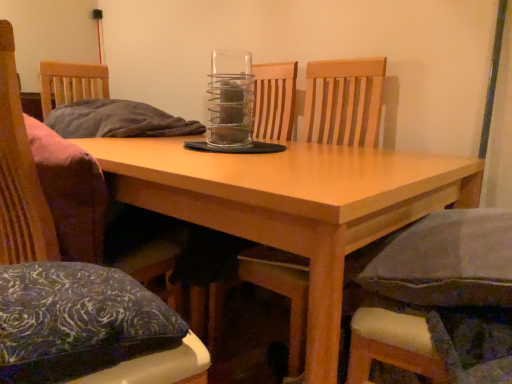
The image size is (512, 384). What do you see at coordinates (437, 301) in the screenshot?
I see `fabric cushioned chair at lower right, marked as the third chair in a left-to-right arrangement` at bounding box center [437, 301].

Find the location of a particular element. This screenshot has width=512, height=384. fabric cushioned chair at lower right, marked as the third chair in a left-to-right arrangement is located at coordinates (437, 301).

Describe the element at coordinates (293, 205) in the screenshot. The image size is (512, 384). I see `light wood table at center` at that location.

Where is `clear glass spiral at center`? clear glass spiral at center is located at coordinates (231, 98).

Can you tell me how much fabric cushioned chair at lower right, positioned as the 1th chair in right-to-left order, and wooden chair at center, which is the second chair in right-to-left order, differ in facing direction?

79.6 degrees separate the facing orientations of fabric cushioned chair at lower right, positioned as the 1th chair in right-to-left order, and wooden chair at center, which is the second chair in right-to-left order.

From the image's perspective, which one is positioned higher, fabric cushioned chair at lower right, marked as the third chair in a left-to-right arrangement, or wooden chair at center, which is the second chair from left to right?

wooden chair at center, which is the second chair from left to right, from the image's perspective.

Does point (410, 350) lie in front of point (337, 129)?

Yes, it is in front of point (337, 129).

From a real-world perspective, between fabric cushioned chair at lower right, marked as the third chair in a left-to-right arrangement, and wooden chair at center, which is the second chair in right-to-left order, who is vertically higher?

fabric cushioned chair at lower right, marked as the third chair in a left-to-right arrangement, from a real-world perspective.

Is fabric cushioned chair at lower right, marked as the third chair in a left-to-right arrangement, positioned behind matte black pillow at center?

No, fabric cushioned chair at lower right, marked as the third chair in a left-to-right arrangement, is in front of matte black pillow at center.

Which of these two, fabric cushioned chair at lower right, marked as the third chair in a left-to-right arrangement, or matte black pillow at center, stands taller?

With more height is matte black pillow at center.

Is fabric cushioned chair at lower right, positioned as the 1th chair in right-to-left order, positioned far away from matte black pillow at center?

fabric cushioned chair at lower right, positioned as the 1th chair in right-to-left order, is actually quite close to matte black pillow at center.

Is fabric cushioned chair at lower right, marked as the third chair in a left-to-right arrangement, looking in the opposite direction of matte black pillow at center?

No, matte black pillow at center is not at the back of fabric cushioned chair at lower right, marked as the third chair in a left-to-right arrangement.

Is clear glass spiral at center at the back of blue patterned pillow at lower left?

No, clear glass spiral at center is not at the back of blue patterned pillow at lower left.

Which is more to the left, blue patterned pillow at lower left or clear glass spiral at center?

From the viewer's perspective, blue patterned pillow at lower left appears more on the left side.

Is blue patterned pillow at lower left with clear glass spiral at center?

No, blue patterned pillow at lower left is not touching clear glass spiral at center.

In terms of height, does blue patterned pillow at lower left look taller or shorter compared to clear glass spiral at center?

Clearly, blue patterned pillow at lower left is shorter compared to clear glass spiral at center.

Which object is positioned more to the right, fabric cushioned chair at lower right, marked as the third chair in a left-to-right arrangement, or blue patterned pillow at lower left?

From the viewer's perspective, fabric cushioned chair at lower right, marked as the third chair in a left-to-right arrangement, appears more on the right side.

Is fabric cushioned chair at lower right, marked as the third chair in a left-to-right arrangement, wider or thinner than blue patterned pillow at lower left?

In the image, fabric cushioned chair at lower right, marked as the third chair in a left-to-right arrangement, appears to be more narrow than blue patterned pillow at lower left.

Between fabric cushioned chair at lower right, marked as the third chair in a left-to-right arrangement, and blue patterned pillow at lower left, which one has larger size?

With larger size is fabric cushioned chair at lower right, marked as the third chair in a left-to-right arrangement.

From the image's perspective, is light wood table at center over fabric cushioned chair at lower right, positioned as the 1th chair in right-to-left order?

No, from the image's perspective, light wood table at center is not above fabric cushioned chair at lower right, positioned as the 1th chair in right-to-left order.

Considering the relative positions of light wood table at center and fabric cushioned chair at lower right, marked as the third chair in a left-to-right arrangement, in the image provided, is light wood table at center to the left of fabric cushioned chair at lower right, marked as the third chair in a left-to-right arrangement, from the viewer's perspective?

Yes, light wood table at center is to the left of fabric cushioned chair at lower right, marked as the third chair in a left-to-right arrangement.

Considering the points (292, 234) and (418, 299), which point is in front, point (292, 234) or point (418, 299)?

Point (292, 234)

Where is `the 1st chair behind when counting from the light wood table at center`? This screenshot has height=384, width=512. the 1st chair behind when counting from the light wood table at center is located at coordinates (437, 301).

Considering the sizes of matte black pillow at center and blue patterned pillow at lower left in the image, is matte black pillow at center taller or shorter than blue patterned pillow at lower left?

matte black pillow at center is taller than blue patterned pillow at lower left.

From the picture: Between matte black pillow at center and blue patterned pillow at lower left, which one has larger size?

matte black pillow at center.

From the image's perspective, is matte black pillow at center under blue patterned pillow at lower left?

No, from the image's perspective, matte black pillow at center is not below blue patterned pillow at lower left.

Considering the points (259, 107) and (140, 342), which point is behind, point (259, 107) or point (140, 342)?

Point (259, 107)

From the image's perspective, would you say clear glass spiral at center is positioned over blue patterned pillow at lower left?

Yes, from the image's perspective, clear glass spiral at center is above blue patterned pillow at lower left.

Find the location of a particular element. The image size is (512, 384). glass jar behind the blue patterned pillow at lower left is located at coordinates (231, 98).

Does point (222, 101) lie in front of point (39, 285)?

No, (222, 101) is behind (39, 285).

Is clear glass spiral at center with blue patterned pillow at lower left?

No, clear glass spiral at center is not beside blue patterned pillow at lower left.

Identify the location of the 2nd chair above the fabric cushioned chair at lower right, marked as the third chair in a left-to-right arrangement (from the image's perspective). (344, 102).

Where is `the 2nd chair to the right of the matte black pillow at center, counting from the anchor's position`? The width and height of the screenshot is (512, 384). the 2nd chair to the right of the matte black pillow at center, counting from the anchor's position is located at coordinates (437, 301).

Considering their positions, is blue patterned pillow at lower left positioned closer to matte black pillow at center than clear glass spiral at center?

Among the two, clear glass spiral at center is located nearer to matte black pillow at center.

When comparing their distances from wooden chair at left, which ranks as the 1th chair in left-to-right order, does wooden chair at center, which is the second chair in right-to-left order, or clear glass spiral at center seem further?

wooden chair at center, which is the second chair in right-to-left order, is positioned further to the anchor wooden chair at left, which ranks as the 1th chair in left-to-right order.

Considering their positions, is wooden chair at center, which is the second chair in right-to-left order, positioned closer to matte black pillow at center than clear glass spiral at center?

wooden chair at center, which is the second chair in right-to-left order, is positioned closer to the anchor matte black pillow at center.

Which object lies nearer to the anchor point clear glass spiral at center, wooden chair at left, which ranks as the 1th chair in left-to-right order, or fabric cushioned chair at lower right, marked as the third chair in a left-to-right arrangement?

The object closer to clear glass spiral at center is wooden chair at left, which ranks as the 1th chair in left-to-right order.

From the image, which object appears to be nearer to clear glass spiral at center, wooden chair at left, which ranks as the 1th chair in left-to-right order, or light wood table at center?

light wood table at center is positioned closer to the anchor clear glass spiral at center.

Based on the photo, considering their positions, is matte black pillow at center positioned further to fabric cushioned chair at lower right, positioned as the 1th chair in right-to-left order, than blue patterned pillow at lower left?

Based on the image, matte black pillow at center appears to be further to fabric cushioned chair at lower right, positioned as the 1th chair in right-to-left order.

Looking at the image, which one is located further to wooden chair at center, which is the second chair in right-to-left order, clear glass spiral at center or fabric cushioned chair at lower right, marked as the third chair in a left-to-right arrangement?

fabric cushioned chair at lower right, marked as the third chair in a left-to-right arrangement, lies further to wooden chair at center, which is the second chair in right-to-left order, than the other object.

Looking at this image, considering their positions, is fabric cushioned chair at lower right, marked as the third chair in a left-to-right arrangement, positioned closer to clear glass spiral at center than matte black pillow at center?

matte black pillow at center lies closer to clear glass spiral at center than the other object.

Where is `pillow between wooden chair at left, marked as the third chair in a right-to-left arrangement, and wooden chair at center, which is the second chair from left to right, from front to back`? The height and width of the screenshot is (384, 512). pillow between wooden chair at left, marked as the third chair in a right-to-left arrangement, and wooden chair at center, which is the second chair from left to right, from front to back is located at coordinates (77, 321).

Find the location of a particular element. The image size is (512, 384). table located between wooden chair at left, marked as the third chair in a right-to-left arrangement, and fabric cushioned chair at lower right, marked as the third chair in a left-to-right arrangement, in the left-right direction is located at coordinates (293, 205).

Where is `table between blue patterned pillow at lower left and clear glass spiral at center in the front-back direction`? This screenshot has width=512, height=384. table between blue patterned pillow at lower left and clear glass spiral at center in the front-back direction is located at coordinates (293, 205).

The width and height of the screenshot is (512, 384). I want to click on chair between wooden chair at left, marked as the third chair in a right-to-left arrangement, and fabric cushioned chair at lower right, marked as the third chair in a left-to-right arrangement, from left to right, so click(x=344, y=102).